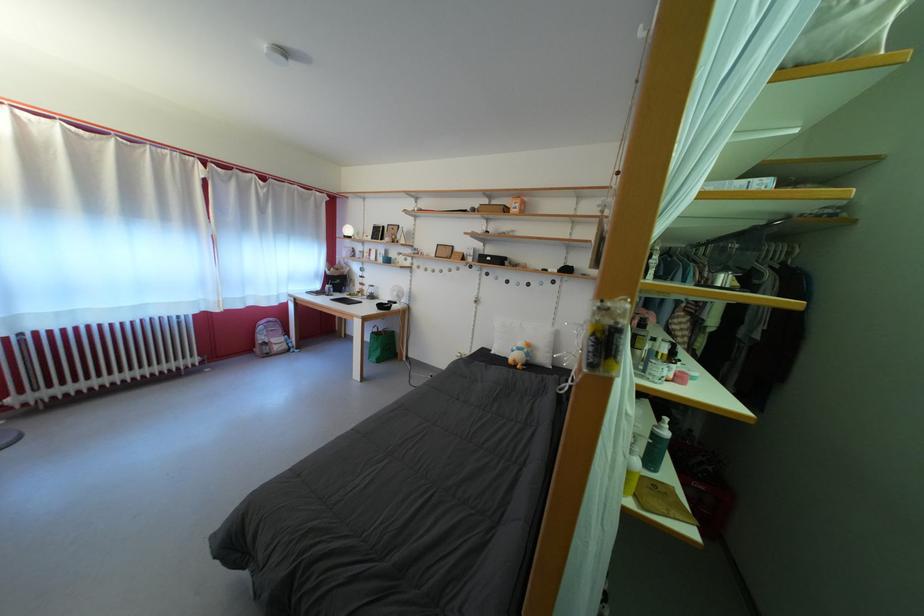
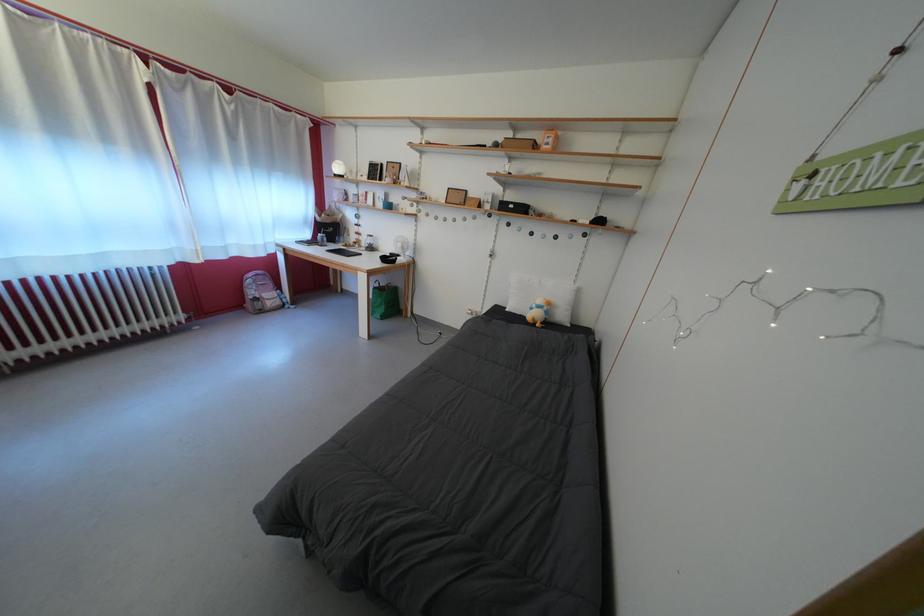
Find the pixel in the second image that matches (404,300) in the first image.

(407, 251)